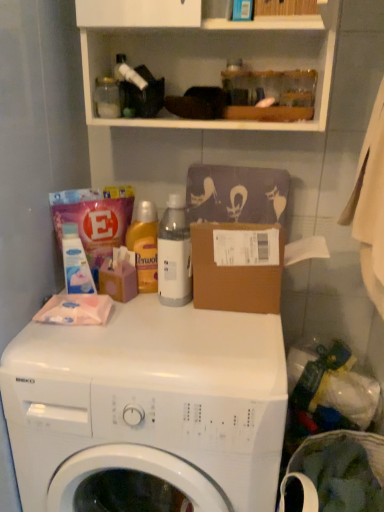
Locate an element on the screen. This screenshot has width=384, height=512. vacant area that lies to the right of white matte detergent at left is located at coordinates (147, 312).